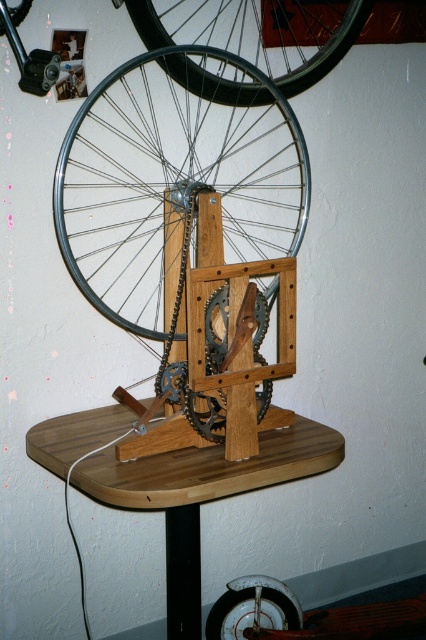
Is metallic silver wheel at upper left thinner than wooden table at center?

Yes.

Does metallic silver wheel at upper left appear on the right side of wooden table at center?

Indeed, metallic silver wheel at upper left is positioned on the right side of wooden table at center.

At what (x,y) coordinates should I click in order to perform the action: click on metallic silver wheel at upper left. Please return your answer as a coordinate pair (x, y). The width and height of the screenshot is (426, 640). Looking at the image, I should click on (175, 173).

Which is behind, point (178, 20) or point (20, 4)?

The point (178, 20) is behind.

Can you confirm if silver metallic bicycle wheel at upper center is wider than black rubber tire at upper center?

Yes.

Where is `silver metallic bicycle wheel at upper center`? The width and height of the screenshot is (426, 640). silver metallic bicycle wheel at upper center is located at coordinates (259, 32).

This screenshot has width=426, height=640. I want to click on silver metallic bicycle wheel at upper center, so click(259, 32).

Looking at this image, is the position of metallic silver wheel at upper left more distant than that of black rubber tire at upper center?

No, metallic silver wheel at upper left is in front of black rubber tire at upper center.

Is metallic silver wheel at upper left shorter than black rubber tire at upper center?

No, metallic silver wheel at upper left is not shorter than black rubber tire at upper center.

Between point (247, 246) and point (20, 4), which one is positioned in front?

Point (20, 4) is in front.

Image resolution: width=426 pixels, height=640 pixels. I want to click on metallic silver wheel at upper left, so click(175, 173).